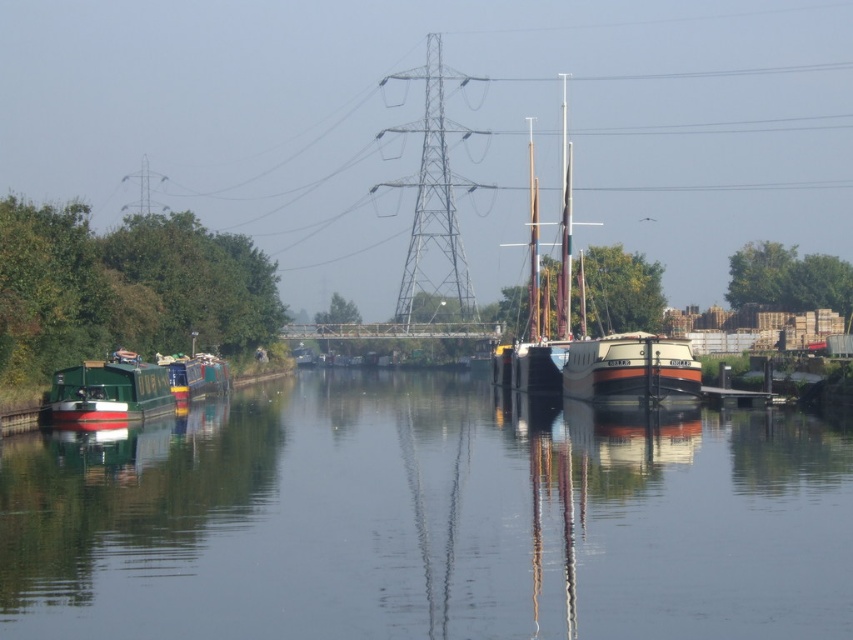
You are a visitor planning to rent a boat for a short trip on the canal. You want to choose the larger one between the green matte canal boat at center and the green matte houseboat at left. Which one should you choose?

You should choose the green matte canal boat at center because it is larger in size than the green matte houseboat at left.

You are navigating a small drone that needs to fly from the wooden sailboat at center to the electrical pylon in the background. According to the coordinates provided, is the pylon positioned to the north or south of the sailboat?

The wooden sailboat at center is located at point (584, 330). Since the pylon is in the background, it is positioned north of the sailboat.

You are standing at the point with coordinates (427, 518) in the canal scene. Which object from the scene are you currently on?

You are on the green matte canal boat at center.